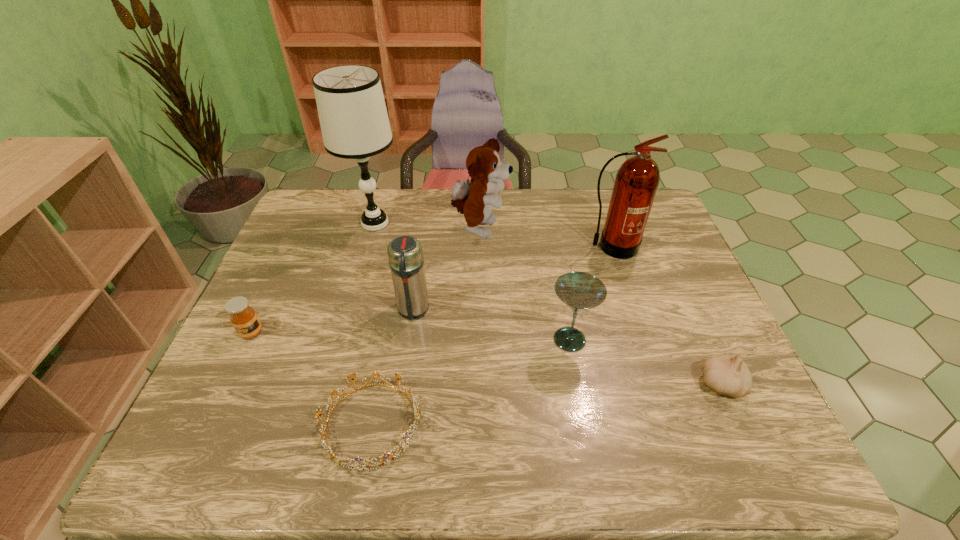
Locate an element on the screen. The width and height of the screenshot is (960, 540). puppy that is at the far edge is located at coordinates (475, 198).

At what (x,y) coordinates should I click in order to perform the action: click on object located in the near edge section of the desktop. Please return your answer as a coordinate pair (x, y). This screenshot has height=540, width=960. Looking at the image, I should click on (334, 392).

Find the location of a particular element. object that is at the left edge is located at coordinates (244, 319).

The height and width of the screenshot is (540, 960). Find the location of `fire extinguisher that is at the right edge`. fire extinguisher that is at the right edge is located at coordinates (637, 180).

Find the location of `garlic located in the right edge section of the desktop`. garlic located in the right edge section of the desktop is located at coordinates (725, 374).

In the image, there is a desktop. Where is `vacant space at the far edge`? The image size is (960, 540). vacant space at the far edge is located at coordinates (392, 218).

The image size is (960, 540). Identify the location of vacant space at the near edge of the desktop. (626, 430).

At what (x,y) coordinates should I click in order to perform the action: click on free location at the left edge of the desktop. Please return your answer as a coordinate pair (x, y). This screenshot has height=540, width=960. Looking at the image, I should click on (288, 242).

You are a GUI agent. You are given a task and a screenshot of the screen. Output one action in this format:
    pyautogui.click(x=<x>, y=<y>)
    Task: Click on the free region at the right edge of the desktop
    
    Given the screenshot: What is the action you would take?
    point(719,400)

Image resolution: width=960 pixels, height=540 pixels. Identify the location of free point between the rightmost object and the sixth object from left to right. (x=645, y=362).